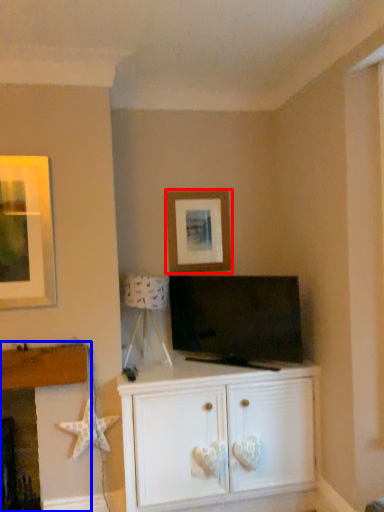
Question: Which object is closer to the camera taking this photo, picture frame (highlighted by a red box) or fireplace (highlighted by a blue box)?

Choices:
 (A) picture frame
 (B) fireplace

Answer: (B)